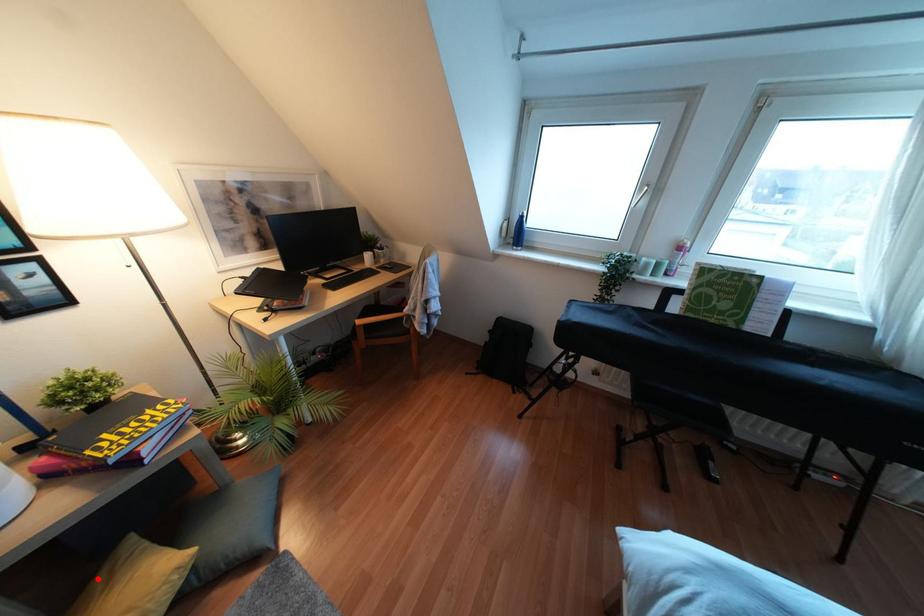
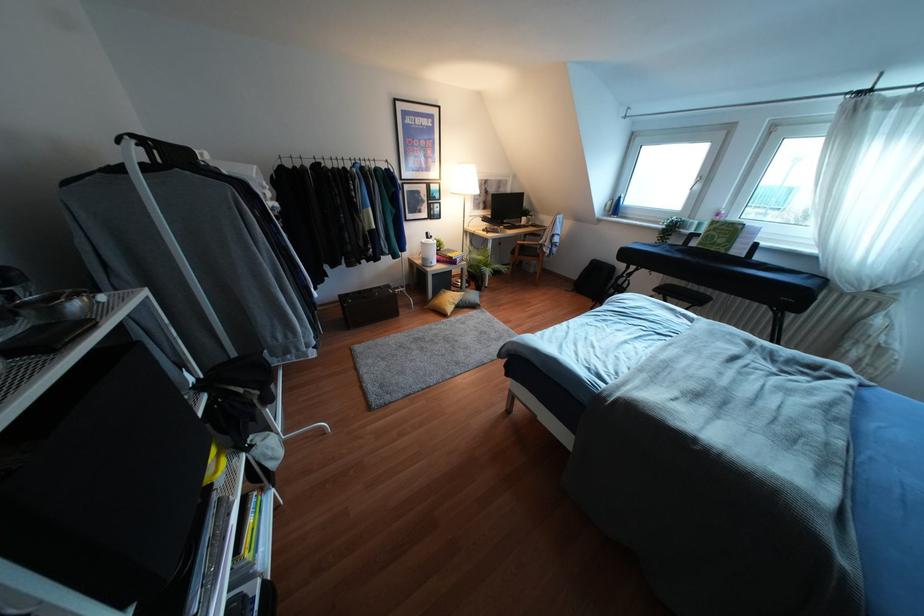
Locate, in the second image, the point that corresponds to the highlighted location in the first image.

(441, 292)